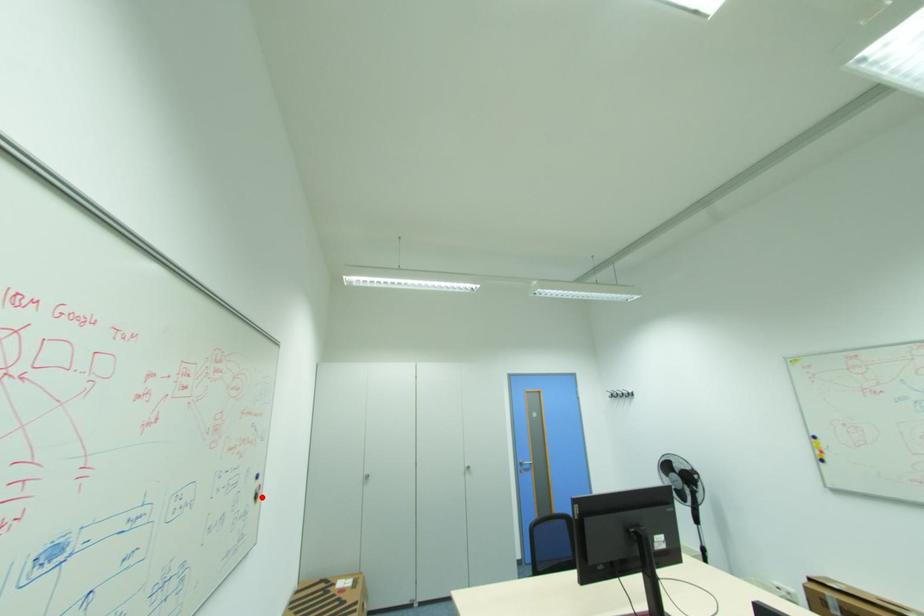
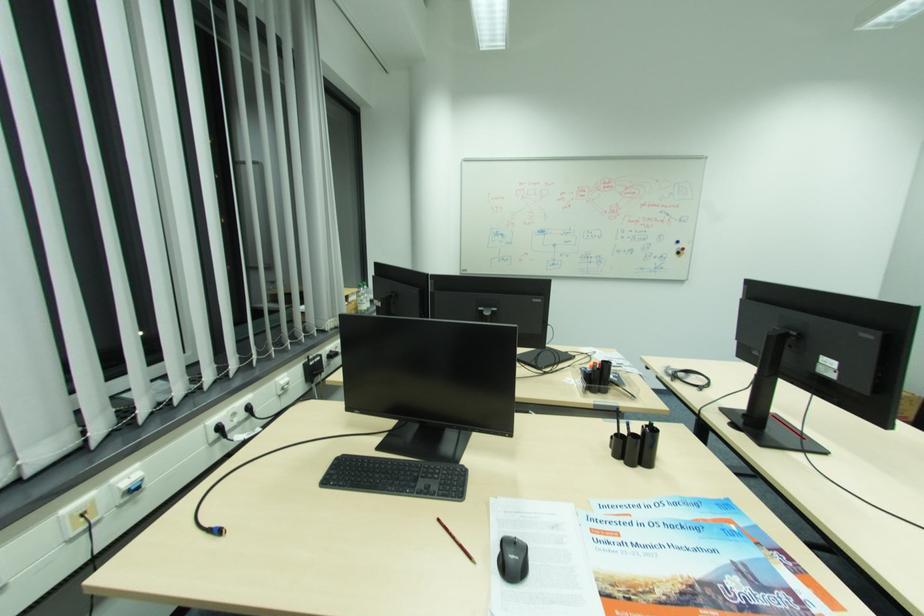
Where in the second image is the point corresponding to the highlighted location from the first image?

(684, 253)